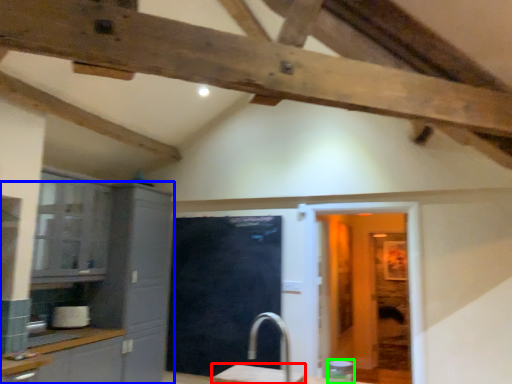
Question: Based on their relative distances, which object is farther from table (highlighted by a red box)? Choose from cabinetry (highlighted by a blue box) and appliance (highlighted by a green box).

Choices:
 (A) cabinetry
 (B) appliance

Answer: (B)